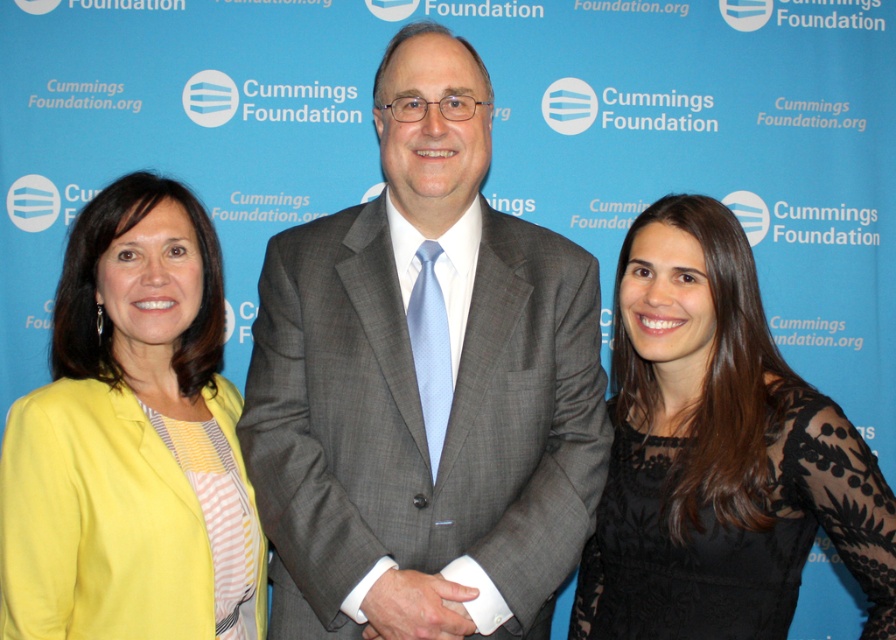
Based on the scene description, which object is wider, the gray suit at center or the black lace dress at center?

The gray suit at center is wider than the black lace dress at center according to the description.

Based on the scene description, which object is taller between the gray suit at center and the black lace dress at center?

The gray suit at center is much taller than the black lace dress at center according to the description.

You are standing at the position of point (455, 604). Looking towards the backdrop, which direction would point (454, 138) be relative to you?

Point (454, 138) is behind point (455, 604), so from your current position at point (455, 604), point (454, 138) would be behind you.